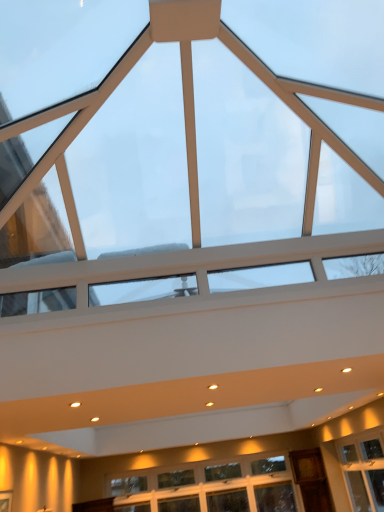
The width and height of the screenshot is (384, 512). Find the location of `transparent glass window at center, the 1th window viewed from the front`. transparent glass window at center, the 1th window viewed from the front is located at coordinates point(280,140).

In order to face transparent glass window at center, which is the 2th window from back to front, should I rotate leftwards or rightwards?

Rotate your view right by about 4.019°.

Consider the image. What is the approximate width of transparent glass window at center, which is the 2th window from back to front?

It is 9.23 feet.

The image size is (384, 512). What do you see at coordinates (280, 140) in the screenshot?
I see `transparent glass window at center, placed as the 1th window when sorted from top to bottom` at bounding box center [280, 140].

What is the approximate height of clear glass window at lower center, the 2th window in the top-to-bottom sequence?

clear glass window at lower center, the 2th window in the top-to-bottom sequence, is 35.03 inches tall.

Identify the location of clear glass window at lower center, the 1th window when ordered from back to front. (212, 488).

What do you see at coordinates (212, 488) in the screenshot?
I see `clear glass window at lower center, arranged as the 2th window when viewed from the front` at bounding box center [212, 488].

Locate an element on the screen. transparent glass window at center, the 1th window viewed from the front is located at coordinates (280, 140).

Is transparent glass window at center, which is the 2th window from back to front, to the left or to the right of clear glass window at lower center, marked as the first window in a bottom-to-top arrangement, in the image?

Clearly, transparent glass window at center, which is the 2th window from back to front, is on the left of clear glass window at lower center, marked as the first window in a bottom-to-top arrangement, in the image.

Which object is closer to the camera, transparent glass window at center, which is the 2th window from back to front, or clear glass window at lower center, the 1th window when ordered from back to front?

transparent glass window at center, which is the 2th window from back to front, is closer to the camera.

Is point (77, 161) in front of point (236, 470)?

That is True.

From the image's perspective, would you say transparent glass window at center, placed as the 1th window when sorted from top to bottom, is positioned over clear glass window at lower center, the 1th window when ordered from back to front?

Yes, from the image's perspective, transparent glass window at center, placed as the 1th window when sorted from top to bottom, is on top of clear glass window at lower center, the 1th window when ordered from back to front.

From a real-world perspective, is transparent glass window at center, placed as the 1th window when sorted from top to bottom, physically below clear glass window at lower center, the 2th window in the top-to-bottom sequence?

Incorrect, from a real-world perspective, transparent glass window at center, placed as the 1th window when sorted from top to bottom, is higher than clear glass window at lower center, the 2th window in the top-to-bottom sequence.

Which object is thinner, transparent glass window at center, which is the 2th window from back to front, or clear glass window at lower center, the 1th window when ordered from back to front?

Thinner between the two is clear glass window at lower center, the 1th window when ordered from back to front.

Considering the sizes of objects transparent glass window at center, placed as the 1th window when sorted from top to bottom, and clear glass window at lower center, the 2th window in the top-to-bottom sequence, in the image provided, who is shorter, transparent glass window at center, placed as the 1th window when sorted from top to bottom, or clear glass window at lower center, the 2th window in the top-to-bottom sequence,?

clear glass window at lower center, the 2th window in the top-to-bottom sequence.

Is transparent glass window at center, placed as the 1th window when sorted from top to bottom, bigger than clear glass window at lower center, the 1th window when ordered from back to front?

Yes.

Is clear glass window at lower center, the 2th window in the top-to-bottom sequence, surrounded by transparent glass window at center, placed as the 1th window when sorted from top to bottom?

That's incorrect, clear glass window at lower center, the 2th window in the top-to-bottom sequence, is not inside transparent glass window at center, placed as the 1th window when sorted from top to bottom.

Would you consider transparent glass window at center, the 1th window viewed from the front, to be distant from clear glass window at lower center, the 1th window when ordered from back to front?

Yes, transparent glass window at center, the 1th window viewed from the front, and clear glass window at lower center, the 1th window when ordered from back to front, are located far from each other.

Could you tell me if transparent glass window at center, the 1th window viewed from the front, is facing clear glass window at lower center, marked as the first window in a bottom-to-top arrangement?

No, transparent glass window at center, the 1th window viewed from the front, is not aimed at clear glass window at lower center, marked as the first window in a bottom-to-top arrangement.

Can you tell me how much transparent glass window at center, placed as the 1th window when sorted from top to bottom, and clear glass window at lower center, arranged as the 2th window when viewed from the front, differ in facing direction?

90.2 degrees separate the facing orientations of transparent glass window at center, placed as the 1th window when sorted from top to bottom, and clear glass window at lower center, arranged as the 2th window when viewed from the front.

Find the location of `window that is on the right side of transparent glass window at center, acting as the second window starting from the bottom`. window that is on the right side of transparent glass window at center, acting as the second window starting from the bottom is located at coordinates (212, 488).

Which is more to the right, clear glass window at lower center, the 1th window when ordered from back to front, or transparent glass window at center, placed as the 1th window when sorted from top to bottom?

From the viewer's perspective, clear glass window at lower center, the 1th window when ordered from back to front, appears more on the right side.

Is clear glass window at lower center, the 1th window when ordered from back to front, in front of or behind transparent glass window at center, acting as the second window starting from the bottom, in the image?

Visually, clear glass window at lower center, the 1th window when ordered from back to front, is located behind transparent glass window at center, acting as the second window starting from the bottom.

Which is closer to the camera, (x=282, y=499) or (x=121, y=85)?

Positioned in front is point (x=121, y=85).

From the image's perspective, which one is positioned lower, clear glass window at lower center, marked as the first window in a bottom-to-top arrangement, or transparent glass window at center, the 1th window viewed from the front?

clear glass window at lower center, marked as the first window in a bottom-to-top arrangement.

From a real-world perspective, is clear glass window at lower center, marked as the first window in a bottom-to-top arrangement, physically below transparent glass window at center, the 1th window viewed from the front?

Yes, from a real-world perspective, clear glass window at lower center, marked as the first window in a bottom-to-top arrangement, is under transparent glass window at center, the 1th window viewed from the front.

Does clear glass window at lower center, the 2th window in the top-to-bottom sequence, have a greater width compared to transparent glass window at center, acting as the second window starting from the bottom?

Incorrect, the width of clear glass window at lower center, the 2th window in the top-to-bottom sequence, does not surpass that of transparent glass window at center, acting as the second window starting from the bottom.

Considering the sizes of clear glass window at lower center, the 2th window in the top-to-bottom sequence, and transparent glass window at center, which is the 2th window from back to front, in the image, is clear glass window at lower center, the 2th window in the top-to-bottom sequence, taller or shorter than transparent glass window at center, which is the 2th window from back to front,?

clear glass window at lower center, the 2th window in the top-to-bottom sequence, is shorter than transparent glass window at center, which is the 2th window from back to front.

Considering the relative sizes of clear glass window at lower center, marked as the first window in a bottom-to-top arrangement, and transparent glass window at center, acting as the second window starting from the bottom, in the image provided, is clear glass window at lower center, marked as the first window in a bottom-to-top arrangement, smaller than transparent glass window at center, acting as the second window starting from the bottom,?

Yes, clear glass window at lower center, marked as the first window in a bottom-to-top arrangement, is smaller than transparent glass window at center, acting as the second window starting from the bottom.

Is clear glass window at lower center, the 1th window when ordered from back to front, surrounding transparent glass window at center, which is the 2th window from back to front?

No, transparent glass window at center, which is the 2th window from back to front, is not inside clear glass window at lower center, the 1th window when ordered from back to front.

Can you see clear glass window at lower center, marked as the first window in a bottom-to-top arrangement, touching transparent glass window at center, acting as the second window starting from the bottom?

No, clear glass window at lower center, marked as the first window in a bottom-to-top arrangement, is not making contact with transparent glass window at center, acting as the second window starting from the bottom.

Is transparent glass window at center, acting as the second window starting from the bottom, at the back of clear glass window at lower center, the 2th window in the top-to-bottom sequence?

No, clear glass window at lower center, the 2th window in the top-to-bottom sequence,'s orientation is not away from transparent glass window at center, acting as the second window starting from the bottom.

Locate an element on the screen. window that is above the clear glass window at lower center, arranged as the 2th window when viewed from the front (from the image's perspective) is located at coordinates (280, 140).

The image size is (384, 512). Identify the location of window above the clear glass window at lower center, the 2th window in the top-to-bottom sequence (from the image's perspective). (280, 140).

I want to click on window that appears on the right of transparent glass window at center, acting as the second window starting from the bottom, so 212,488.